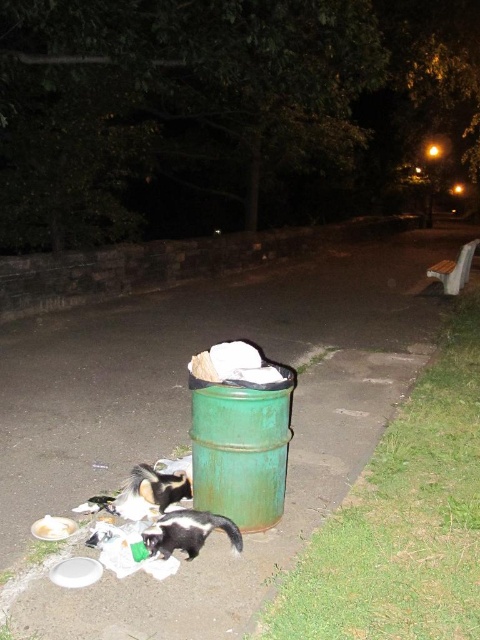
You are a sanitation worker assigned to collect trash in the park. You see a green metallic trash can at lower center located at point (189, 417). Is there any obstruction between your current position and the trash can at that point?

The green metallic trash can at lower center is located at point (189, 417). The scene description mentions no obstructions between your current position and the trash can, so there should be a clear path to it.

You are a cat owner who wants to ensure your black and white fur cat at lower center stays safe from the trash. Given that the green metallic trash can at lower center is taller than the cat, can the cat reach the top of the trash can to get into it?

The green metallic trash can at lower center is taller than the black and white fur cat at lower center, so the cat cannot reach the top of the trash can to get into it.